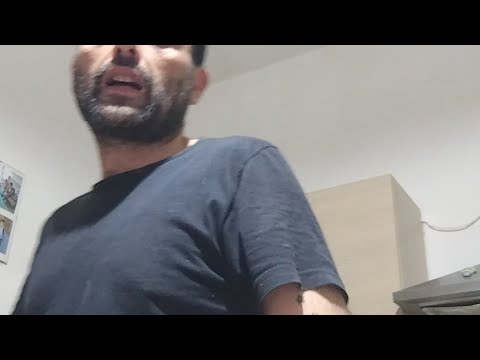
The image size is (480, 360). I want to click on picture, so (17, 187).